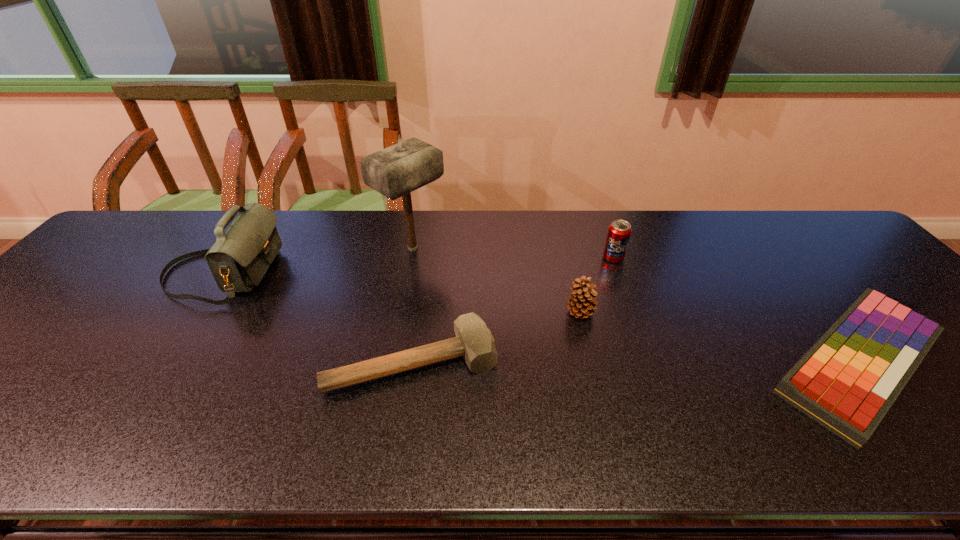
Where is `the farther mallet`? The height and width of the screenshot is (540, 960). the farther mallet is located at coordinates (396, 171).

What are the coordinates of `the tallest object` in the screenshot? It's located at (396, 171).

Find the location of a particular element. The width and height of the screenshot is (960, 540). the leftmost object is located at coordinates (238, 260).

You are a GUI agent. You are given a task and a screenshot of the screen. Output one action in this format:
    pyautogui.click(x=<x>, y=<y>)
    Task: Click on the shoulder bag
    This screenshot has width=960, height=540.
    Given the screenshot: What is the action you would take?
    pyautogui.click(x=238, y=260)

This screenshot has width=960, height=540. Identify the location of the fourth object from left to right. (581, 303).

This screenshot has height=540, width=960. In order to click on soda can in this screenshot , I will do `click(619, 231)`.

I want to click on the nearer mallet, so click(x=474, y=341).

The width and height of the screenshot is (960, 540). I want to click on vacant space located on the right of the farther mallet, so click(471, 248).

The width and height of the screenshot is (960, 540). What are the coordinates of `vacant space located 0.230m on the left of the shoulder bag` in the screenshot? It's located at (83, 273).

You are a GUI agent. You are given a task and a screenshot of the screen. Output one action in this format:
    pyautogui.click(x=<x>, y=<y>)
    Task: Click on the vacant space located on the right of the fourth object from left to right
    
    Given the screenshot: What is the action you would take?
    pyautogui.click(x=627, y=312)